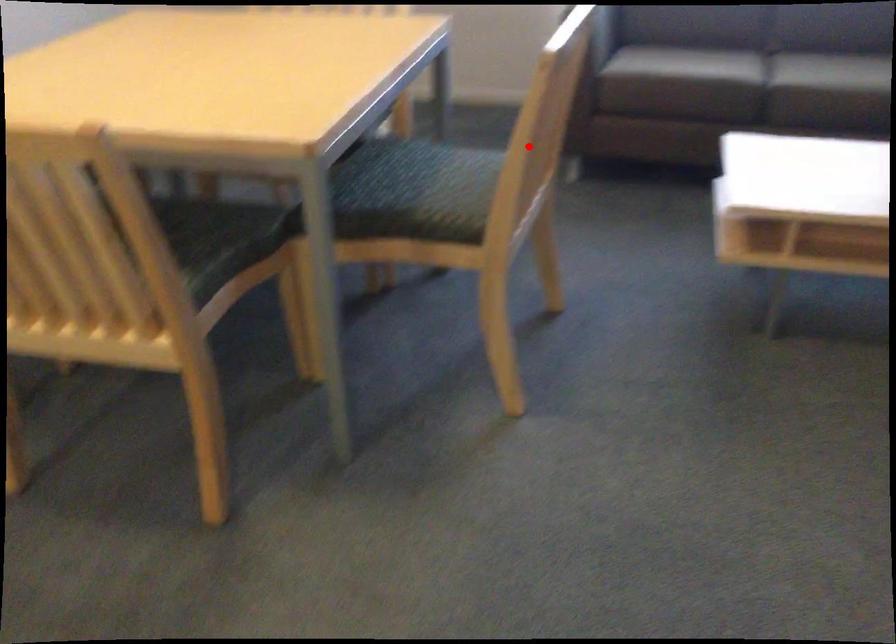
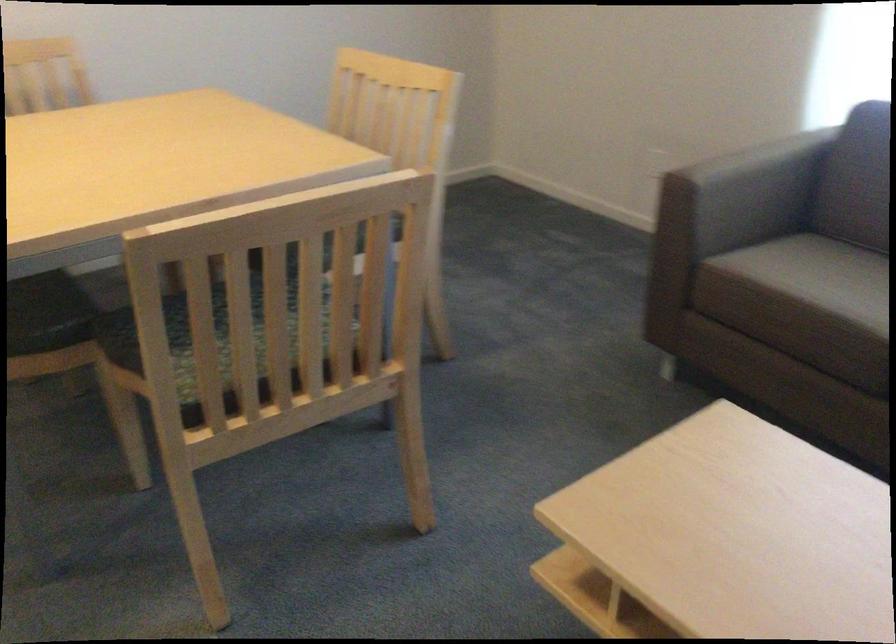
Locate, in the second image, the point that corresponds to the highlighted location in the first image.

(211, 334)